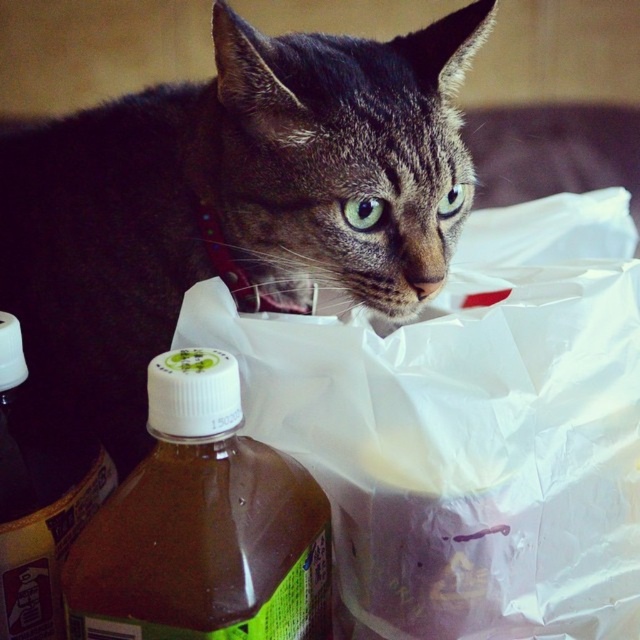
Question: Estimate the real-world distances between objects in this image. Which object is farther from the brown matte bottle at lower left?

Choices:
 (A) white plastic bag at center
 (B) tabby fur cat at center

Answer: (A)

Question: Can you confirm if tabby fur cat at center is thinner than brown matte bottle at lower left?

Choices:
 (A) yes
 (B) no

Answer: (B)

Question: Does tabby fur cat at center have a smaller size compared to brown translucent bottle at lower left?

Choices:
 (A) yes
 (B) no

Answer: (B)

Question: Which object is farther from the camera taking this photo?

Choices:
 (A) tabby fur cat at center
 (B) brown translucent bottle at lower left
 (C) brown matte bottle at lower left
 (D) white plastic bag at center

Answer: (A)

Question: Can you confirm if white plastic bag at center is smaller than tabby fur cat at center?

Choices:
 (A) no
 (B) yes

Answer: (A)

Question: Which of the following is the closest to the observer?

Choices:
 (A) (77, 477)
 (B) (310, 532)
 (C) (72, 141)

Answer: (B)